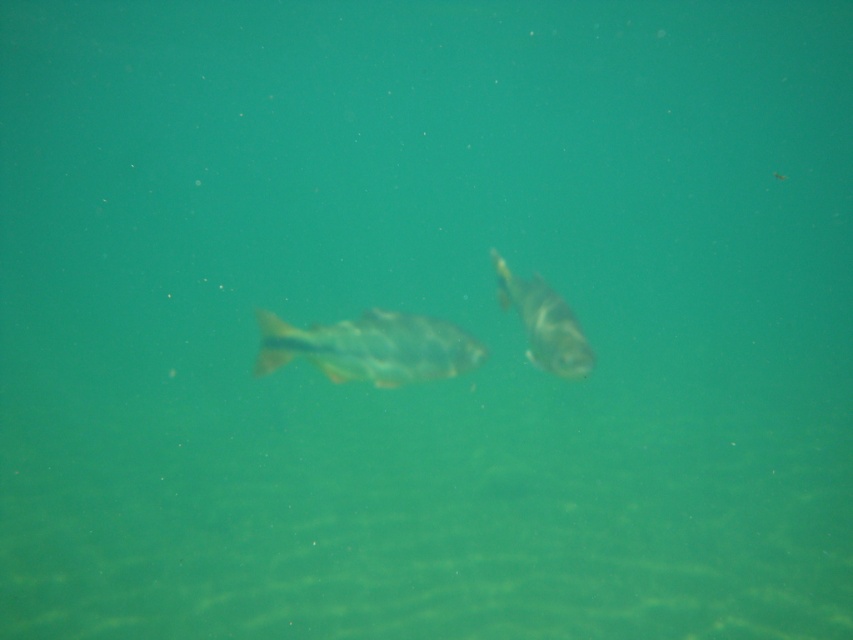
You are a marine biologist studying underwater life. You observe an image of an underwater scene with a speckled silver fish at center. Based on its 2D coordinates in the image, can you determine if the fish is positioned closer to the top or bottom of the image?

The 2D location of the speckled silver fish at center is at point [370,348]. In a standard coordinate system, the y coordinate determines vertical position, with 0 being the top and 1 the bottom. Since 0.436 is closer to 0.5 than 0, the fish is positioned closer to the center vertically, but since the question is about top or bottom, it is closer to the top than the bottom as 0.436 is less than 0.5.

You are a marine biologist observing two fish in an underwater environment. You notice a speckled silver fish at center and a shiny silver fish at center. Which fish has a greater width?

The speckled silver fish at center has a greater width than the shiny silver fish at center.

You are a marine biologist observing two fish in an underwater scene. You notice a speckled silver fish at center and a shiny silver fish at center. Which fish has a smaller height?

The speckled silver fish at center is not as tall as the shiny silver fish at center, so the speckled silver fish at center has a smaller height.